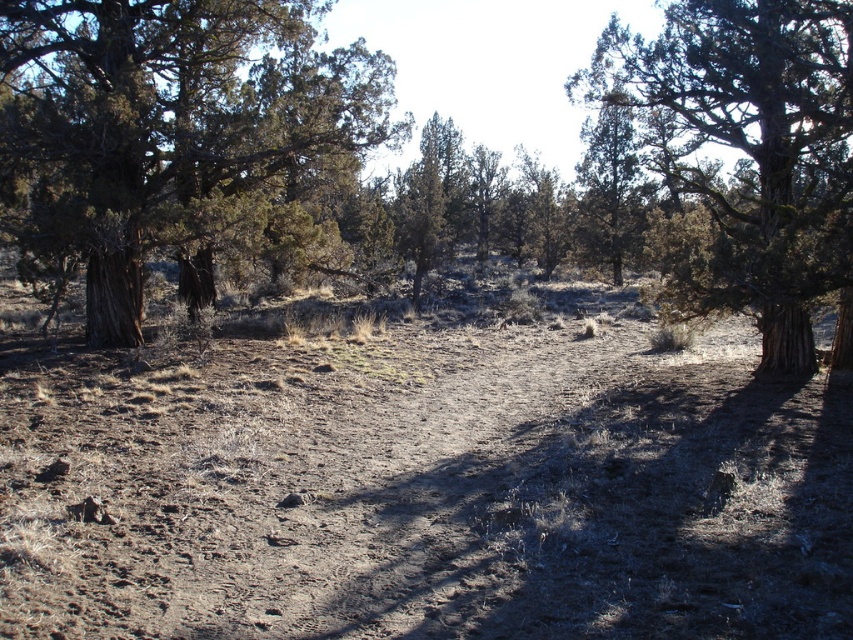
Question: Among these points, which one is farthest from the camera?

Choices:
 (A) (323, 269)
 (B) (421, 561)
 (C) (553, 228)

Answer: (C)

Question: Which point appears farthest from the camera in this image?

Choices:
 (A) (740, 134)
 (B) (242, 81)
 (C) (13, 148)

Answer: (B)

Question: Can you confirm if brown dirt field at center is thinner than green textured tree at center?

Choices:
 (A) yes
 (B) no

Answer: (B)

Question: Can you confirm if brown dirt field at center is positioned to the left of dark brown bark tree at upper left?

Choices:
 (A) no
 (B) yes

Answer: (A)

Question: Which of the following is the closest to the observer?

Choices:
 (A) (775, 224)
 (B) (194, 120)
 (C) (618, 586)

Answer: (C)

Question: Is brown dirt field at center positioned in front of brown textured trees at center?

Choices:
 (A) yes
 (B) no

Answer: (A)